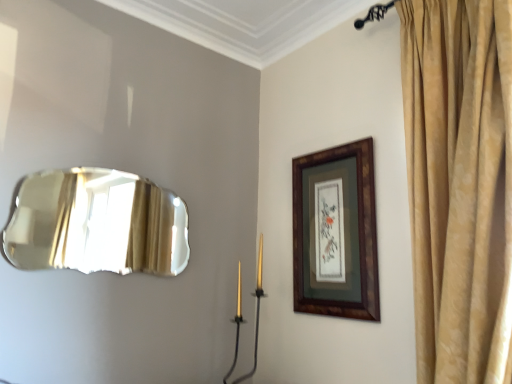
Where is `shiny metallic mirror at left`? The width and height of the screenshot is (512, 384). shiny metallic mirror at left is located at coordinates (96, 224).

Between point (252, 370) and point (309, 162), which one is positioned behind?

Positioned behind is point (252, 370).

Is the position of gold metallic candle holder at center more distant than that of wooden frame at upper right?

Yes, it is.

Considering the positions of objects gold metallic candle holder at center and wooden frame at upper right in the image provided, who is more to the right, gold metallic candle holder at center or wooden frame at upper right?

wooden frame at upper right.

Would you say shiny metallic mirror at left is part of gold velvet curtain at upper right's contents?

Definitely not — shiny metallic mirror at left is not inside gold velvet curtain at upper right.

From the image's perspective, is gold velvet curtain at upper right located above or below shiny metallic mirror at left?

From the image's perspective, gold velvet curtain at upper right appears above shiny metallic mirror at left.

Is gold velvet curtain at upper right in front of or behind shiny metallic mirror at left in the image?

Clearly, gold velvet curtain at upper right is in front of shiny metallic mirror at left.

Who is bigger, gold velvet curtain at upper right or shiny metallic mirror at left?

Bigger between the two is gold velvet curtain at upper right.

Is shiny metallic mirror at left to the left of gold metallic candle holder at center from the viewer's perspective?

Yes, shiny metallic mirror at left is to the left of gold metallic candle holder at center.

Are shiny metallic mirror at left and gold metallic candle holder at center located far from each other?

shiny metallic mirror at left is actually quite close to gold metallic candle holder at center.

Is shiny metallic mirror at left facing away from gold metallic candle holder at center?

No, shiny metallic mirror at left's orientation is not away from gold metallic candle holder at center.

Based on the photo, from the image's perspective, which is below, shiny metallic mirror at left or gold metallic candle holder at center?

gold metallic candle holder at center is shown below in the image.

Considering the positions of points (409, 141) and (296, 241), is point (409, 141) closer to camera compared to point (296, 241)?

Yes.

Considering the sizes of objects gold velvet curtain at upper right and wooden frame at upper right in the image provided, who is bigger, gold velvet curtain at upper right or wooden frame at upper right?

With larger size is gold velvet curtain at upper right.

From a real-world perspective, who is located lower, gold velvet curtain at upper right or wooden frame at upper right?

wooden frame at upper right.

Is gold velvet curtain at upper right facing away from wooden frame at upper right?

gold velvet curtain at upper right does not have its back to wooden frame at upper right.

Considering the positions of objects gold metallic candle holder at center and gold velvet curtain at upper right in the image provided, who is more to the right, gold metallic candle holder at center or gold velvet curtain at upper right?

gold velvet curtain at upper right.

In the scene shown: Is gold metallic candle holder at center situated inside gold velvet curtain at upper right or outside?

gold metallic candle holder at center cannot be found inside gold velvet curtain at upper right.

Which object is thinner, gold metallic candle holder at center or gold velvet curtain at upper right?

With smaller width is gold metallic candle holder at center.

Is gold metallic candle holder at center beside gold velvet curtain at upper right?

They are not placed beside each other.

From the picture: Is wooden frame at upper right positioned far away from shiny metallic mirror at left?

No, wooden frame at upper right is not far away from shiny metallic mirror at left.

From a real-world perspective, relative to shiny metallic mirror at left, is wooden frame at upper right vertically above or below?

In terms of real-world spatial position, wooden frame at upper right is below shiny metallic mirror at left.

Which is farther from the camera, (x=313, y=262) or (x=88, y=204)?

The point (x=88, y=204) is farther from the camera.

Does wooden frame at upper right have a lesser width compared to shiny metallic mirror at left?

Correct, the width of wooden frame at upper right is less than that of shiny metallic mirror at left.

Is shiny metallic mirror at left aimed at wooden frame at upper right?

No.

From the image's perspective, which object appears higher, shiny metallic mirror at left or wooden frame at upper right?

shiny metallic mirror at left.

From a real-world perspective, relative to wooden frame at upper right, is shiny metallic mirror at left vertically above or below?

Clearly, from a real-world perspective, shiny metallic mirror at left is above wooden frame at upper right.

Based on their sizes in the image, would you say shiny metallic mirror at left is bigger or smaller than wooden frame at upper right?

Considering their sizes, shiny metallic mirror at left takes up more space than wooden frame at upper right.

Image resolution: width=512 pixels, height=384 pixels. Identify the location of candle holder lying below the wooden frame at upper right (from the image's perspective). (256, 309).

Image resolution: width=512 pixels, height=384 pixels. I want to click on curtain in front of the shiny metallic mirror at left, so pyautogui.click(x=459, y=185).

Which object lies nearer to the anchor point gold metallic candle holder at center, gold velvet curtain at upper right or wooden frame at upper right?

Based on the image, wooden frame at upper right appears to be nearer to gold metallic candle holder at center.

Based on their spatial positions, is wooden frame at upper right or gold metallic candle holder at center further from shiny metallic mirror at left?

wooden frame at upper right lies further to shiny metallic mirror at left than the other object.

Based on their spatial positions, is shiny metallic mirror at left or gold velvet curtain at upper right closer to wooden frame at upper right?

gold velvet curtain at upper right.

Which object lies further to the anchor point wooden frame at upper right, gold velvet curtain at upper right or gold metallic candle holder at center?

The object further to wooden frame at upper right is gold metallic candle holder at center.

Which object lies nearer to the anchor point wooden frame at upper right, gold metallic candle holder at center or shiny metallic mirror at left?

The object closer to wooden frame at upper right is gold metallic candle holder at center.

Estimate the real-world distances between objects in this image. Which object is closer to gold metallic candle holder at center, shiny metallic mirror at left or gold velvet curtain at upper right?

shiny metallic mirror at left is closer to gold metallic candle holder at center.

From the picture: Considering their positions, is wooden frame at upper right positioned further to gold velvet curtain at upper right than gold metallic candle holder at center?

gold metallic candle holder at center is positioned further to the anchor gold velvet curtain at upper right.

Looking at the image, which one is located further to wooden frame at upper right, gold velvet curtain at upper right or shiny metallic mirror at left?

shiny metallic mirror at left lies further to wooden frame at upper right than the other object.

Find the location of a particular element. The height and width of the screenshot is (384, 512). candle holder between shiny metallic mirror at left and wooden frame at upper right in the horizontal direction is located at coordinates coord(256,309).

The height and width of the screenshot is (384, 512). I want to click on candle holder between shiny metallic mirror at left and gold velvet curtain at upper right, so click(256, 309).

The height and width of the screenshot is (384, 512). In order to click on picture frame located between shiny metallic mirror at left and gold velvet curtain at upper right in the left-right direction in this screenshot , I will do `click(336, 233)`.

Find the location of `picture frame positioned between gold velvet curtain at upper right and gold metallic candle holder at center from near to far`. picture frame positioned between gold velvet curtain at upper right and gold metallic candle holder at center from near to far is located at coordinates (336, 233).